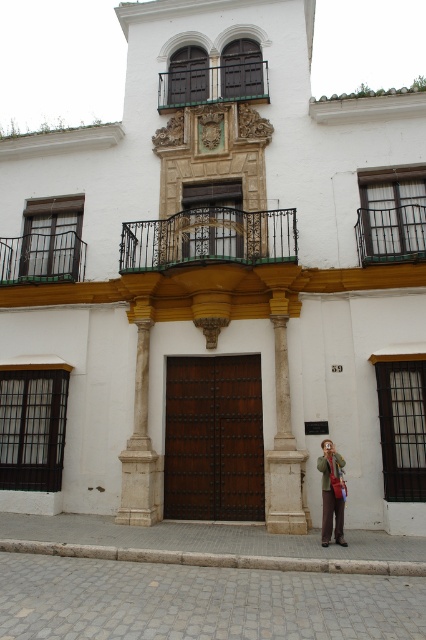
Can you confirm if white marble column at center is positioned above dark wood balcony at upper center?

No.

Can you confirm if white marble column at center is positioned to the left of dark wood balcony at upper center?

Yes, white marble column at center is to the left of dark wood balcony at upper center.

Is point (147, 310) positioned behind point (247, 74)?

No, it is not.

Where is `white marble column at center`? Image resolution: width=426 pixels, height=640 pixels. white marble column at center is located at coordinates 138,435.

Who is more forward, (3,268) or (221,93)?

Positioned in front is point (3,268).

From the picture: Who is more distant from viewer, (80, 275) or (158, 97)?

The point (158, 97) is more distant.

Locate an element on the screen. This screenshot has width=426, height=640. green glass balcony at upper left is located at coordinates (42, 257).

How much distance is there between green wrought iron balcony at center and rustic wrought iron balcony at upper right?

green wrought iron balcony at center and rustic wrought iron balcony at upper right are 2.46 meters apart from each other.

This screenshot has height=640, width=426. What do you see at coordinates (209, 237) in the screenshot?
I see `green wrought iron balcony at center` at bounding box center [209, 237].

Who is more distant from viewer, (138, 248) or (371, 218)?

Positioned behind is point (138, 248).

The height and width of the screenshot is (640, 426). In order to click on green wrought iron balcony at center in this screenshot , I will do `click(209, 237)`.